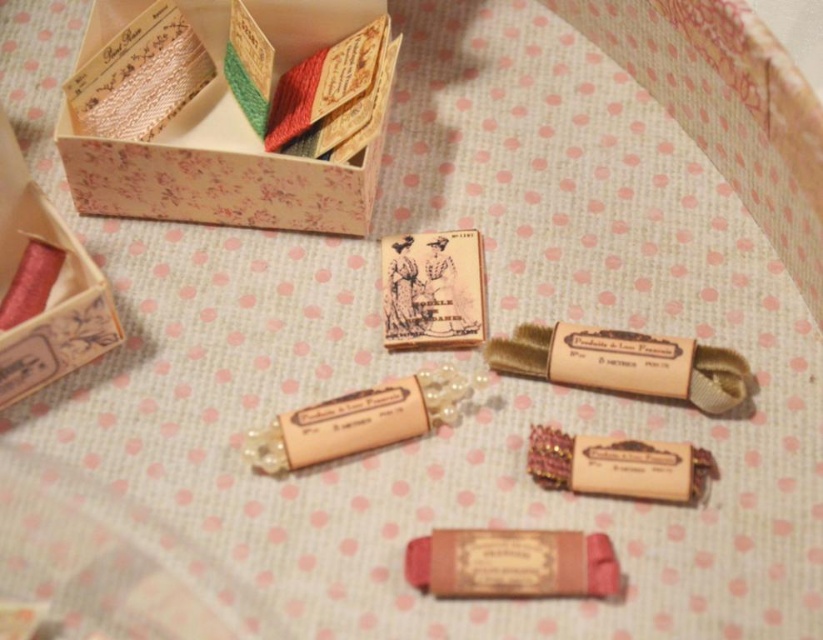
You are a craft enthusiast trying to organize your sewing kit. You have two threads in front of you on the fabric background, the matte pink thread at center and the matte brown thread at center. Which thread is wider?

The matte pink thread at center is wider than the matte brown thread at center according to the description.